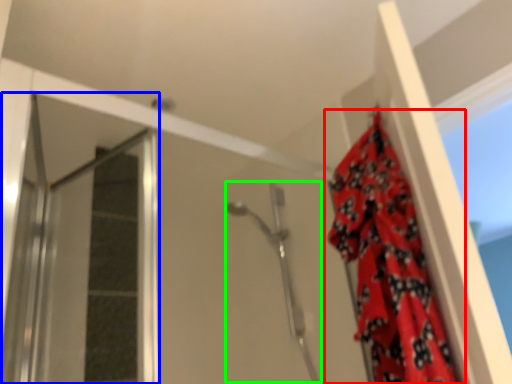
Question: Considering the real-world distances, which object is closest to curtain (highlighted by a red box)? screen door (highlighted by a blue box) or shower (highlighted by a green box).

Choices:
 (A) screen door
 (B) shower

Answer: (B)